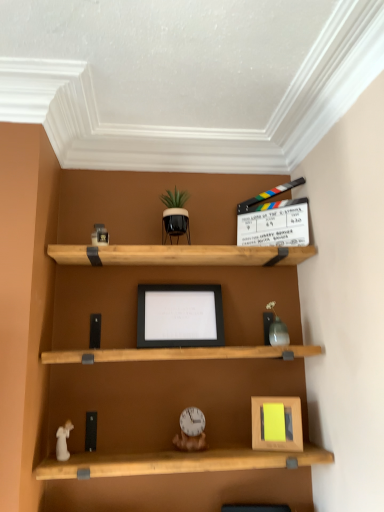
At what (x,y) coordinates should I click in order to perform the action: click on wooden picture frame at lower right, positioned as the first picture frame in bottom-to-top order. Please return your answer as a coordinate pair (x, y). The image size is (384, 512). Looking at the image, I should click on (277, 423).

How much space does black matte picture frame at center, the 2th picture frame viewed from the right, occupy horizontally?

The width of black matte picture frame at center, the 2th picture frame viewed from the right, is 2.63 inches.

You are a GUI agent. You are given a task and a screenshot of the screen. Output one action in this format:
    pyautogui.click(x=<x>, y=<y>)
    Task: Click on the metallic gold toy at upper left, the third toy viewed from the right
    The image size is (384, 512).
    Given the screenshot: What is the action you would take?
    pyautogui.click(x=100, y=234)

Identify the location of wooden clock at center, which ranks as the first toy in bottom-to-top order. The width and height of the screenshot is (384, 512). (191, 430).

What is the approximate height of matte gray vase at upper right, acting as the fourth toy starting from the left?

The height of matte gray vase at upper right, acting as the fourth toy starting from the left, is 7.75 inches.

This screenshot has width=384, height=512. What do you see at coordinates (277, 331) in the screenshot? I see `matte gray vase at upper right, the 3th toy ordered from the bottom` at bounding box center [277, 331].

This screenshot has width=384, height=512. In order to click on wooden picture frame at lower right, placed as the 1th picture frame when sorted from front to back in this screenshot , I will do `click(277, 423)`.

Consider the image. From the image's perspective, is black matte picture frame at center, positioned as the first picture frame in back-to-front order, located above wooden picture frame at lower right, which appears as the 1th picture frame when viewed from the right?

Yes, from the image's perspective, black matte picture frame at center, positioned as the first picture frame in back-to-front order, is over wooden picture frame at lower right, which appears as the 1th picture frame when viewed from the right.

In the image, is black matte picture frame at center, the 2th picture frame viewed from the right, on the left side or the right side of wooden picture frame at lower right, placed as the 2th picture frame when sorted from left to right?

Clearly, black matte picture frame at center, the 2th picture frame viewed from the right, is on the left of wooden picture frame at lower right, placed as the 2th picture frame when sorted from left to right, in the image.

From a real-world perspective, relative to wooden picture frame at lower right, which is counted as the 2th picture frame, starting from the top, is black matte picture frame at center, which is the 1th picture frame in top-to-bottom order, vertically above or below?

In terms of real-world spatial position, black matte picture frame at center, which is the 1th picture frame in top-to-bottom order, is above wooden picture frame at lower right, which is counted as the 2th picture frame, starting from the top.

Is black matte picture frame at center, which is the first picture frame from left to right, shorter than wooden picture frame at lower right, placed as the 2th picture frame when sorted from left to right?

In fact, black matte picture frame at center, which is the first picture frame from left to right, may be taller than wooden picture frame at lower right, placed as the 2th picture frame when sorted from left to right.

Based on the photo, in terms of width, does black matte picture frame at center, which is the first picture frame from left to right, look wider or thinner when compared to matte gray vase at upper right, acting as the fourth toy starting from the left?

In the image, black matte picture frame at center, which is the first picture frame from left to right, appears to be more narrow than matte gray vase at upper right, acting as the fourth toy starting from the left.

Can you tell me how much black matte picture frame at center, placed as the second picture frame when sorted from bottom to top, and matte gray vase at upper right, the first toy viewed from the right, differ in facing direction?

black matte picture frame at center, placed as the second picture frame when sorted from bottom to top, and matte gray vase at upper right, the first toy viewed from the right, are facing 1.94 degrees away from each other.

In the scene shown: Considering the relative positions of black matte picture frame at center, placed as the second picture frame when sorted from bottom to top, and matte gray vase at upper right, acting as the fourth toy starting from the left, in the image provided, is black matte picture frame at center, placed as the second picture frame when sorted from bottom to top, to the left or to the right of matte gray vase at upper right, acting as the fourth toy starting from the left,?

From the image, it's evident that black matte picture frame at center, placed as the second picture frame when sorted from bottom to top, is to the left of matte gray vase at upper right, acting as the fourth toy starting from the left.

Is matte gray vase at upper right, acting as the fourth toy starting from the left, in front of or behind wooden picture frame at lower right, which is counted as the 2th picture frame, starting from the top, in the image?

Clearly, matte gray vase at upper right, acting as the fourth toy starting from the left, is behind wooden picture frame at lower right, which is counted as the 2th picture frame, starting from the top.

How far apart are matte gray vase at upper right, acting as the fourth toy starting from the left, and wooden picture frame at lower right, which is counted as the 2th picture frame, starting from the top?

matte gray vase at upper right, acting as the fourth toy starting from the left, is 12.15 inches from wooden picture frame at lower right, which is counted as the 2th picture frame, starting from the top.

In the scene shown: Is matte gray vase at upper right, the 3th toy ordered from the bottom, smaller than wooden picture frame at lower right, positioned as the first picture frame in bottom-to-top order?

Indeed, matte gray vase at upper right, the 3th toy ordered from the bottom, has a smaller size compared to wooden picture frame at lower right, positioned as the first picture frame in bottom-to-top order.

Is matte gray vase at upper right, acting as the fourth toy starting from the left, turned away from wooden picture frame at lower right, which appears as the second picture frame when viewed from the back?

matte gray vase at upper right, acting as the fourth toy starting from the left, does not have its back to wooden picture frame at lower right, which appears as the second picture frame when viewed from the back.

Find the location of a particular element. toy that is the 1st one when counting backward from the white porcelain angel at lower left, positioned as the 4th toy in right-to-left order is located at coordinates (191, 430).

Considering the positions of objects wooden clock at center, the second toy viewed from the right, and white porcelain angel at lower left, the first toy in the left-to-right sequence, in the image provided, who is behind, wooden clock at center, the second toy viewed from the right, or white porcelain angel at lower left, the first toy in the left-to-right sequence,?

wooden clock at center, the second toy viewed from the right, is more distant.

From their relative heights in the image, would you say wooden clock at center, the second toy viewed from the right, is taller or shorter than white porcelain angel at lower left, the first toy in the left-to-right sequence?

Clearly, wooden clock at center, the second toy viewed from the right, is taller compared to white porcelain angel at lower left, the first toy in the left-to-right sequence.

From the image's perspective, is wooden clock at center, which ranks as the first toy in bottom-to-top order, under white porcelain angel at lower left, the first toy in the left-to-right sequence?

Indeed, from the image's perspective, wooden clock at center, which ranks as the first toy in bottom-to-top order, is shown beneath white porcelain angel at lower left, the first toy in the left-to-right sequence.

From the picture: How many degrees apart are the facing directions of metallic gold toy at upper left, the third toy viewed from the right, and wooden picture frame at lower right, positioned as the first picture frame in bottom-to-top order?

The angle between the facing direction of metallic gold toy at upper left, the third toy viewed from the right, and the facing direction of wooden picture frame at lower right, positioned as the first picture frame in bottom-to-top order, is 26 degrees.

Between metallic gold toy at upper left, placed as the 2th toy when sorted from left to right, and wooden picture frame at lower right, positioned as the first picture frame in bottom-to-top order, which one is positioned in front?

wooden picture frame at lower right, positioned as the first picture frame in bottom-to-top order.

How much distance is there between metallic gold toy at upper left, placed as the 2th toy when sorted from left to right, and wooden picture frame at lower right, positioned as the first picture frame in bottom-to-top order?

metallic gold toy at upper left, placed as the 2th toy when sorted from left to right, is 37.80 inches from wooden picture frame at lower right, positioned as the first picture frame in bottom-to-top order.

From a real-world perspective, is metallic gold toy at upper left, the first toy in the top-to-bottom sequence, physically located above or below wooden picture frame at lower right, which appears as the second picture frame when viewed from the back?

Clearly, from a real-world perspective, metallic gold toy at upper left, the first toy in the top-to-bottom sequence, is above wooden picture frame at lower right, which appears as the second picture frame when viewed from the back.

Considering the positions of points (298, 441) and (96, 241), is point (298, 441) closer to camera compared to point (96, 241)?

Yes, point (298, 441) is in front of point (96, 241).

From a real-world perspective, count 2nd picture frames downward from the metallic gold toy at upper left, the first toy in the top-to-bottom sequence, and point to it. Please provide its 2D coordinates.

[(277, 423)]

Is wooden picture frame at lower right, which appears as the 1th picture frame when viewed from the right, inside the boundaries of metallic gold toy at upper left, which appears as the fourth toy when ordered from the bottom, or outside?

wooden picture frame at lower right, which appears as the 1th picture frame when viewed from the right, cannot be found inside metallic gold toy at upper left, which appears as the fourth toy when ordered from the bottom.

Considering the positions of points (276, 325) and (102, 245), is point (276, 325) closer to camera compared to point (102, 245)?

That is False.

Would you consider matte gray vase at upper right, the second toy from the top, to be distant from metallic gold toy at upper left, placed as the 2th toy when sorted from left to right?

No, matte gray vase at upper right, the second toy from the top, is not far away from metallic gold toy at upper left, placed as the 2th toy when sorted from left to right.

From a real-world perspective, count 1st toys downward from the metallic gold toy at upper left, the first toy in the top-to-bottom sequence, and point to it. Please provide its 2D coordinates.

[(277, 331)]

Considering the relative positions of matte gray vase at upper right, acting as the fourth toy starting from the left, and metallic gold toy at upper left, which appears as the fourth toy when ordered from the bottom, in the image provided, is matte gray vase at upper right, acting as the fourth toy starting from the left, to the right of metallic gold toy at upper left, which appears as the fourth toy when ordered from the bottom, from the viewer's perspective?

Correct, you'll find matte gray vase at upper right, acting as the fourth toy starting from the left, to the right of metallic gold toy at upper left, which appears as the fourth toy when ordered from the bottom.

Identify the location of picture frame below the black matte picture frame at center, which is the first picture frame from left to right (from a real-world perspective). Image resolution: width=384 pixels, height=512 pixels. (277, 423).

The width and height of the screenshot is (384, 512). I want to click on the 1st toy in front of the black matte picture frame at center, the 2th picture frame viewed from the front, starting your count from the anchor, so click(x=277, y=331).

Considering their positions, is wooden picture frame at lower right, placed as the 2th picture frame when sorted from left to right, positioned further to matte gray vase at upper right, acting as the fourth toy starting from the left, than metallic gold toy at upper left, the third toy viewed from the right?

metallic gold toy at upper left, the third toy viewed from the right, is positioned further to the anchor matte gray vase at upper right, acting as the fourth toy starting from the left.

Estimate the real-world distances between objects in this image. Which object is closer to wooden clock at center, which ranks as the 3th toy in left-to-right order, metallic gold toy at upper left, the third toy viewed from the right, or white porcelain angel at lower left, positioned as the 4th toy in right-to-left order?

Based on the image, white porcelain angel at lower left, positioned as the 4th toy in right-to-left order, appears to be nearer to wooden clock at center, which ranks as the 3th toy in left-to-right order.

Considering their positions, is black matte picture frame at center, the 2th picture frame viewed from the right, positioned further to wooden picture frame at lower right, which appears as the second picture frame when viewed from the back, than metallic gold toy at upper left, the third toy viewed from the right?

Based on the image, metallic gold toy at upper left, the third toy viewed from the right, appears to be further to wooden picture frame at lower right, which appears as the second picture frame when viewed from the back.

Based on the photo, looking at the image, which one is located closer to black matte picture frame at center, which is the first picture frame from left to right, matte gray vase at upper right, acting as the fourth toy starting from the left, or metallic gold toy at upper left, the third toy viewed from the right?

matte gray vase at upper right, acting as the fourth toy starting from the left, lies closer to black matte picture frame at center, which is the first picture frame from left to right, than the other object.

Considering their positions, is wooden clock at center, which ranks as the 3th toy in left-to-right order, positioned closer to black matte picture frame at center, the 2th picture frame viewed from the front, than wooden picture frame at lower right, placed as the 1th picture frame when sorted from front to back?

Among the two, wooden clock at center, which ranks as the 3th toy in left-to-right order, is located nearer to black matte picture frame at center, the 2th picture frame viewed from the front.

Estimate the real-world distances between objects in this image. Which object is closer to wooden clock at center, which ranks as the 3th toy in left-to-right order, matte gray vase at upper right, acting as the fourth toy starting from the left, or wooden picture frame at lower right, positioned as the first picture frame in bottom-to-top order?

wooden picture frame at lower right, positioned as the first picture frame in bottom-to-top order, is positioned closer to the anchor wooden clock at center, which ranks as the 3th toy in left-to-right order.

Looking at the image, which one is located closer to metallic gold toy at upper left, the first toy in the top-to-bottom sequence, black matte picture frame at center, which is the first picture frame from left to right, or white porcelain angel at lower left, the first toy in the left-to-right sequence?

black matte picture frame at center, which is the first picture frame from left to right, is positioned closer to the anchor metallic gold toy at upper left, the first toy in the top-to-bottom sequence.

From the image, which object appears to be farther from wooden clock at center, which ranks as the 3th toy in left-to-right order, black matte picture frame at center, which is the 1th picture frame in top-to-bottom order, or metallic gold toy at upper left, the third toy viewed from the right?

Among the two, metallic gold toy at upper left, the third toy viewed from the right, is located further to wooden clock at center, which ranks as the 3th toy in left-to-right order.

The height and width of the screenshot is (512, 384). I want to click on picture frame situated between black matte picture frame at center, which is the 1th picture frame in top-to-bottom order, and matte gray vase at upper right, the second toy from the top, from left to right, so click(277, 423).

Locate an element on the screen. Image resolution: width=384 pixels, height=512 pixels. picture frame between metallic gold toy at upper left, which appears as the fourth toy when ordered from the bottom, and wooden picture frame at lower right, which appears as the second picture frame when viewed from the back, in the up-down direction is located at coordinates (180, 316).

The height and width of the screenshot is (512, 384). In order to click on picture frame between white porcelain angel at lower left, the first toy in the left-to-right sequence, and wooden clock at center, arranged as the fourth toy when viewed from the top, in the horizontal direction in this screenshot , I will do `click(180, 316)`.

Locate an element on the screen. The image size is (384, 512). picture frame between matte gray vase at upper right, the first toy viewed from the right, and wooden clock at center, the second toy viewed from the right, vertically is located at coordinates (277, 423).